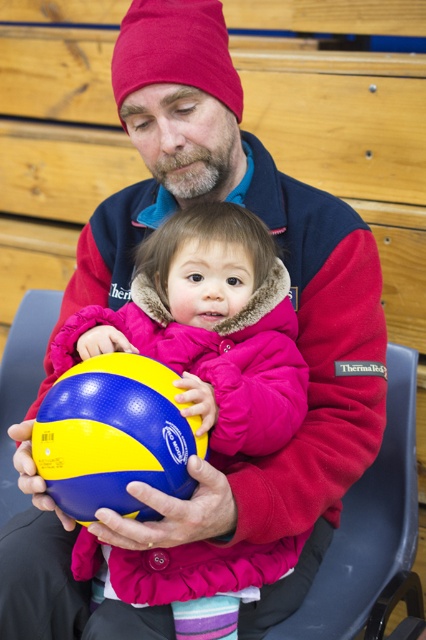
Question: Which of the following is the farthest from the observer?

Choices:
 (A) (100, 381)
 (B) (176, 314)

Answer: (B)

Question: Is matte blue/yellow ball at center closer to the viewer compared to yellow and blue rubber ball at center?

Choices:
 (A) yes
 (B) no

Answer: (B)

Question: Is matte blue/yellow ball at center further to camera compared to yellow and blue rubber ball at center?

Choices:
 (A) yes
 (B) no

Answer: (A)

Question: Is matte blue/yellow ball at center above yellow and blue rubber ball at center?

Choices:
 (A) no
 (B) yes

Answer: (B)